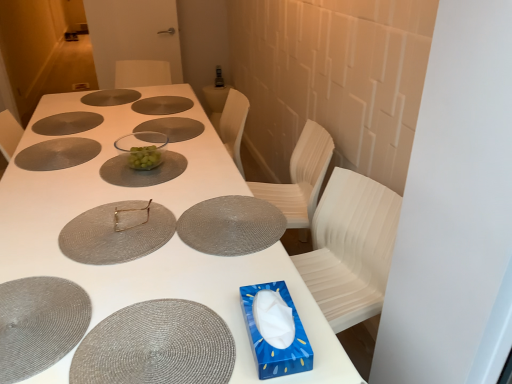
Where is `free space in front of matte gray glass plate at upper left, which is counted as the 7th glass plate, starting from the front`? The image size is (512, 384). free space in front of matte gray glass plate at upper left, which is counted as the 7th glass plate, starting from the front is located at coordinates (54, 140).